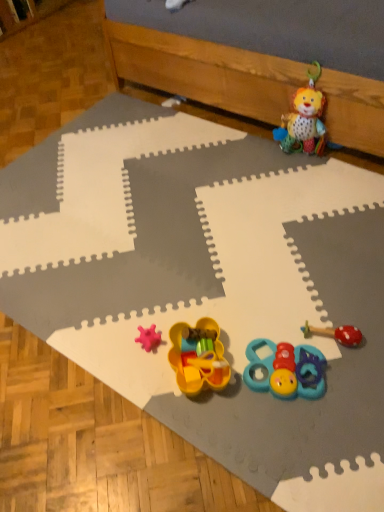
Where is `free location to the right of teal rubber teething toy at lower center, positioned as the second toy in front-to-back order`? The image size is (384, 512). free location to the right of teal rubber teething toy at lower center, positioned as the second toy in front-to-back order is located at coordinates (357, 367).